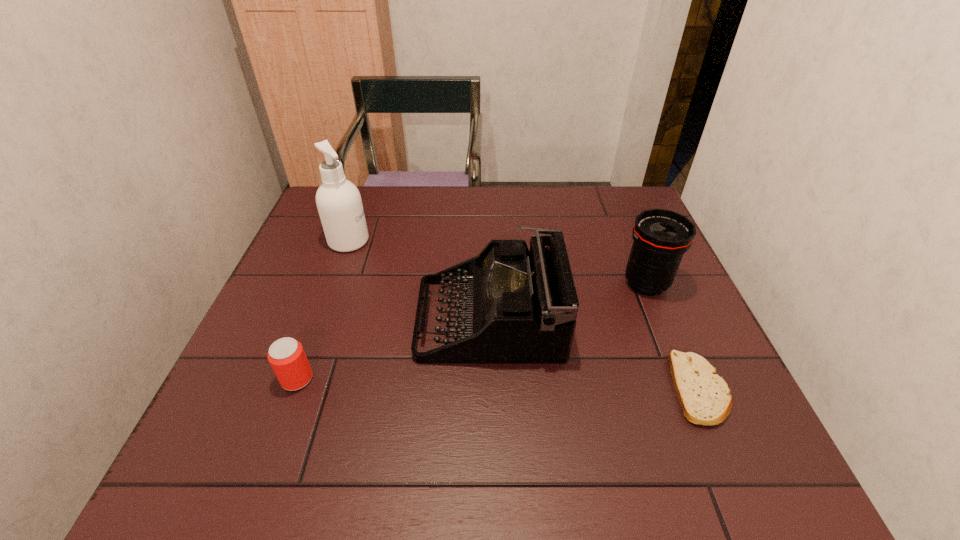
This screenshot has height=540, width=960. In order to click on the tallest object in this screenshot , I will do `click(339, 204)`.

Find the location of a particular element. This screenshot has width=960, height=540. the farthest object is located at coordinates (339, 204).

Where is `telephoto lens`? The image size is (960, 540). telephoto lens is located at coordinates (661, 237).

Identify the location of typewriter. The image size is (960, 540). click(x=518, y=306).

You are a GUI agent. You are given a task and a screenshot of the screen. Output one action in this format:
    pyautogui.click(x=<x>, y=<y>)
    Task: Click on the fourth tallest object
    
    Given the screenshot: What is the action you would take?
    pyautogui.click(x=286, y=356)

Identify the location of pita bread. The width and height of the screenshot is (960, 540). (704, 396).

Locate an element on the screen. This screenshot has width=960, height=540. free location located 0.100m on the front label of the tallest object is located at coordinates (404, 241).

Where is `blank area located on the back of the telephoto lens`? This screenshot has height=540, width=960. blank area located on the back of the telephoto lens is located at coordinates [626, 233].

This screenshot has width=960, height=540. What are the coordinates of `free space located on the typing side of the third object from right to left` in the screenshot? It's located at (271, 318).

This screenshot has height=540, width=960. Identify the location of vacant space located 0.260m on the typing side of the third object from right to left. (308, 318).